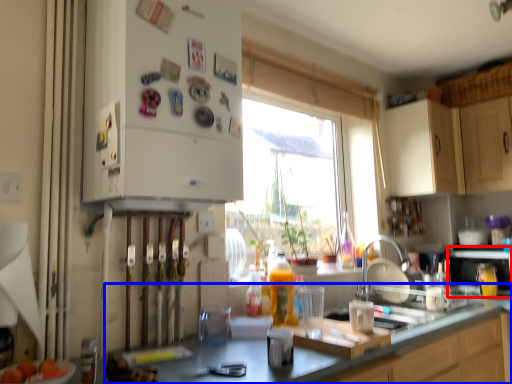
Question: Which of the following is the farthest to the observer, appliance (highlighted by a red box) or countertop (highlighted by a blue box)?

Choices:
 (A) appliance
 (B) countertop

Answer: (A)